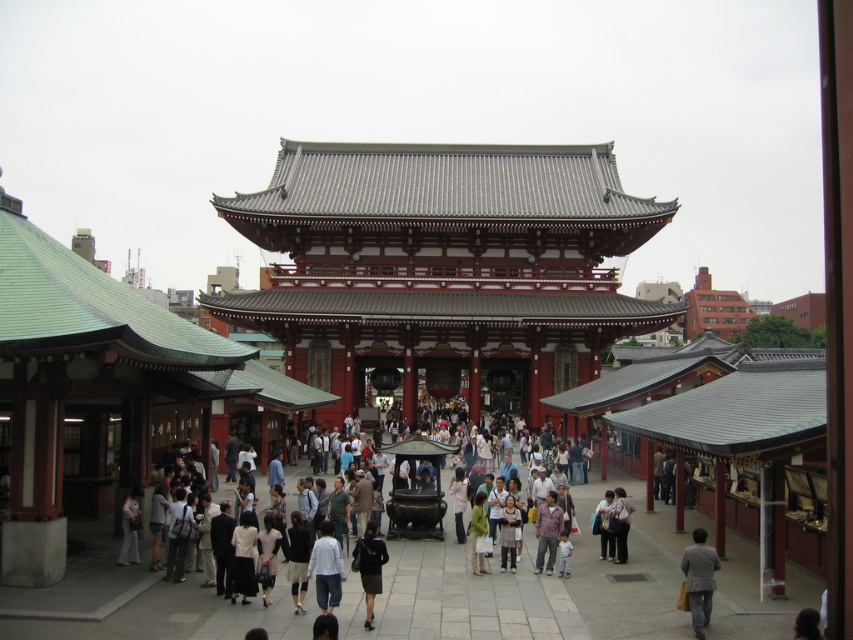
Question: Among these objects, which one is farthest from the camera?

Choices:
 (A) matte gray suit at lower right
 (B) printed cotton shirt at center
 (C) black fabric skirt at center

Answer: (B)

Question: Which point is farther to the camera?

Choices:
 (A) white cotton shirt at center
 (B) red lacquered temple gate at center
 (C) printed cotton shirt at center
 (D) black fabric skirt at center

Answer: (B)

Question: Is black fabric skirt at center closer to camera compared to printed cotton shirt at center?

Choices:
 (A) no
 (B) yes

Answer: (B)

Question: Can you confirm if red lacquered temple gate at center is positioned to the left of black fabric skirt at center?

Choices:
 (A) yes
 (B) no

Answer: (B)

Question: Which point is closer to the camera?

Choices:
 (A) (695, 634)
 (B) (366, 625)
 (C) (635, 323)
 (D) (321, 561)

Answer: (A)

Question: Observing the image, what is the correct spatial positioning of red lacquered temple gate at center in reference to matte gray suit at lower right?

Choices:
 (A) below
 (B) above

Answer: (B)